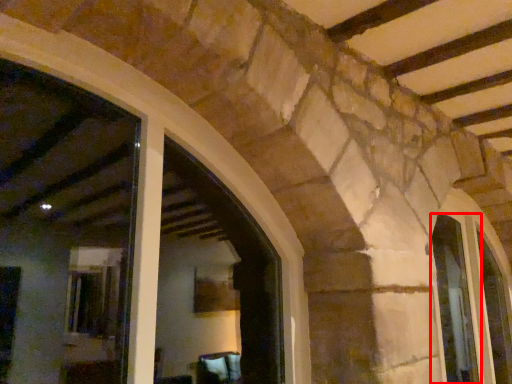
Question: Where is window (annotated by the red box) located in relation to window in the image?

Choices:
 (A) left
 (B) right

Answer: (A)